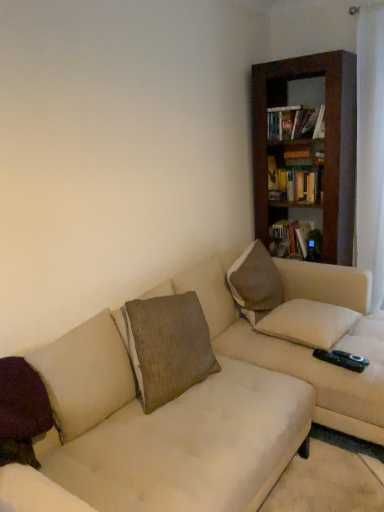
Question: Do you think beige fabric couch at center is within purple velvet pillow at lower left, placed as the third pillow when sorted from right to left, or outside of it?

Choices:
 (A) inside
 (B) outside

Answer: (B)

Question: Looking at the image, does beige fabric couch at center seem bigger or smaller compared to purple velvet pillow at lower left, placed as the 1th pillow when sorted from front to back?

Choices:
 (A) small
 (B) big

Answer: (B)

Question: Estimate the real-world distances between objects in this image. Which object is farther from the beige fabric couch at center?

Choices:
 (A) white fabric curtain at right
 (B) brown textured pillow at upper right, which appears as the second pillow when viewed from the right
 (C) brown wooden bookcase at upper right
 (D) purple velvet pillow at lower left, which appears as the 3th pillow when viewed from the back
 (E) hardcover book at upper right, the 1th book in the front-to-back sequence

Answer: (E)

Question: Which of these objects is positioned closest to the brown wooden bookcase at upper right?

Choices:
 (A) beige fabric couch at center
 (B) purple velvet pillow at lower left, placed as the third pillow when sorted from right to left
 (C) hardcover book at upper right, the 1th book in the front-to-back sequence
 (D) hardcover book at upper right, the second book in the top-to-bottom sequence
 (E) white fabric curtain at right

Answer: (C)